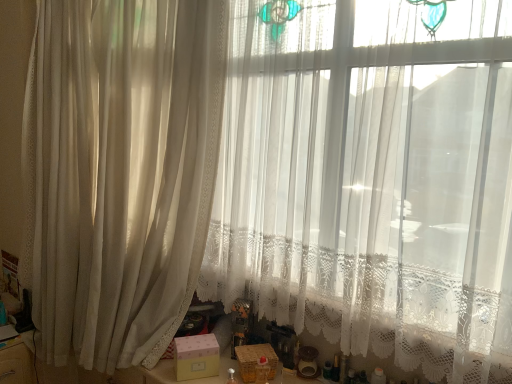
Question: Looking at their shapes, would you say wooden basket at lower center, which appears as the first box when viewed from the right, is wider or thinner than sheer white curtain at left?

Choices:
 (A) wide
 (B) thin

Answer: (B)

Question: From their relative heights in the image, would you say wooden basket at lower center, which appears as the first box when viewed from the right, is taller or shorter than sheer white curtain at left?

Choices:
 (A) tall
 (B) short

Answer: (B)

Question: Estimate the real-world distances between objects in this image. Which object is farther from the sheer white curtain at left?

Choices:
 (A) wooden basket at lower center, marked as the 2th box in a left-to-right arrangement
 (B) pink matte box at center, the first box in the left-to-right sequence

Answer: (A)

Question: Which of these objects is positioned closest to the pink matte box at center, the first box in the left-to-right sequence?

Choices:
 (A) wooden basket at lower center, which appears as the first box when viewed from the right
 (B) sheer white curtain at left

Answer: (A)